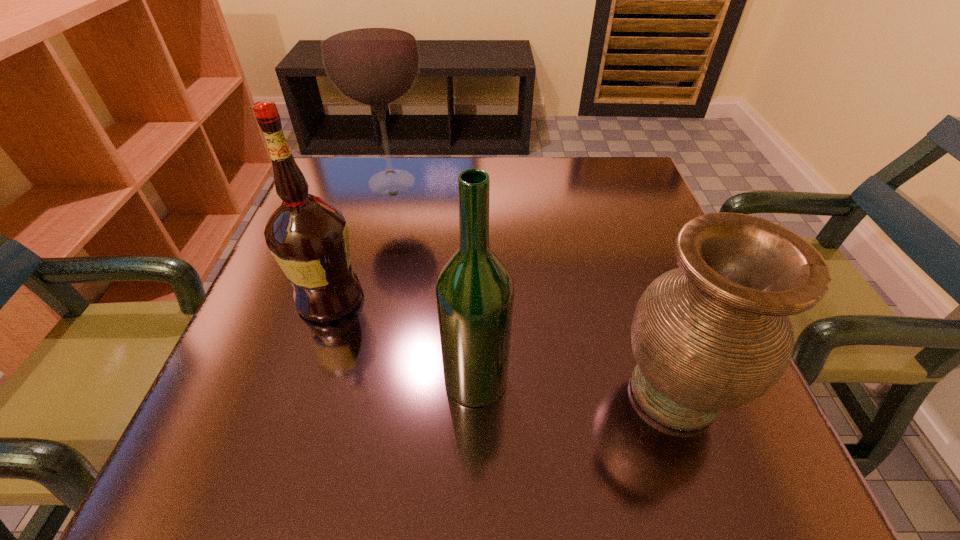
Locate an element on the screen. Image resolution: width=960 pixels, height=540 pixels. the farthest object is located at coordinates (370, 53).

You are a GUI agent. You are given a task and a screenshot of the screen. Output one action in this format:
    pyautogui.click(x=<x>, y=<y>)
    Task: Click on the second nearest alcohol
    The image size is (960, 540).
    Given the screenshot: What is the action you would take?
    pyautogui.click(x=308, y=237)

I want to click on the nearest alcohol, so click(x=474, y=289).

Identify the location of the rightmost alcohol. (474, 289).

Locate an element on the screen. vase is located at coordinates tap(714, 334).

In order to click on the rightmost object in this screenshot , I will do `click(714, 334)`.

What are the coordinates of `vacant space located 0.300m on the right of the farthest object` in the screenshot? It's located at (554, 183).

You are a GUI agent. You are given a task and a screenshot of the screen. Output one action in this format:
    pyautogui.click(x=<x>, y=<y>)
    Task: Click on the free space located 0.220m on the label of the third nearest object
    This screenshot has width=960, height=540.
    Given the screenshot: What is the action you would take?
    pyautogui.click(x=483, y=298)

Locate an element on the screen. Image resolution: width=960 pixels, height=540 pixels. vacant region located on the right of the second object from right to left is located at coordinates (578, 379).

You are a GUI agent. You are given a task and a screenshot of the screen. Output one action in this format:
    pyautogui.click(x=<x>, y=<y>)
    Task: Click on the free space located on the back of the shortest object
    Image resolution: width=960 pixels, height=540 pixels.
    Given the screenshot: What is the action you would take?
    pyautogui.click(x=618, y=233)